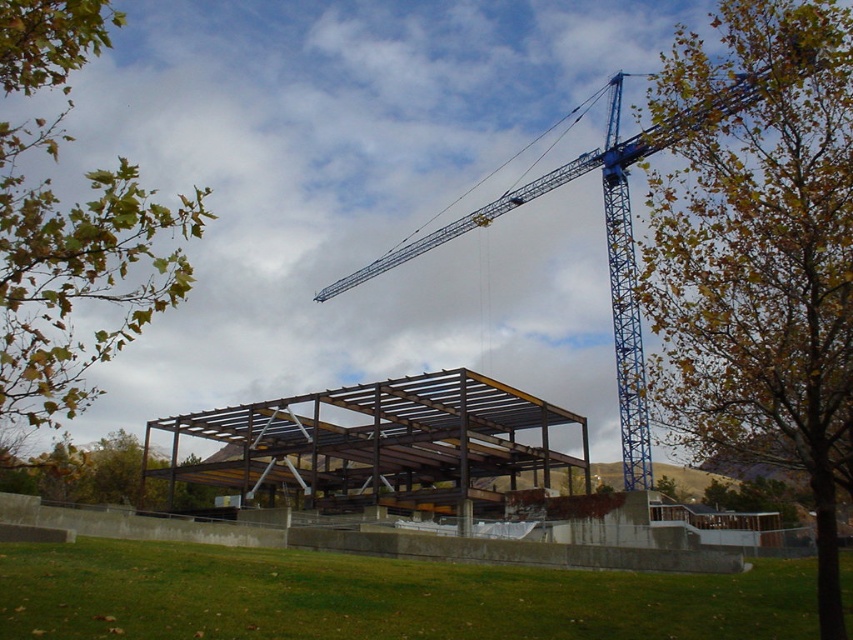
Question: From the image, what is the correct spatial relationship of brown leafy tree at upper right in relation to green leafy branches at upper left?

Choices:
 (A) above
 (B) below

Answer: (B)

Question: Which object appears closest to the camera in this image?

Choices:
 (A) metal/structurally sound roof at center
 (B) green leafy branches at upper left

Answer: (B)

Question: Which point appears farthest from the camera in this image?

Choices:
 (A) (367, 449)
 (B) (15, 378)
 (C) (648, 484)

Answer: (A)

Question: Does brown leafy tree at upper right have a greater width compared to blue metallic crane at center?

Choices:
 (A) no
 (B) yes

Answer: (A)

Question: Does brown leafy tree at upper right have a larger size compared to green leafy branches at upper left?

Choices:
 (A) no
 (B) yes

Answer: (A)

Question: Estimate the real-world distances between objects in this image. Which object is closer to the blue metallic crane at center?

Choices:
 (A) green leafy branches at upper left
 (B) metal/structurally sound roof at center

Answer: (B)